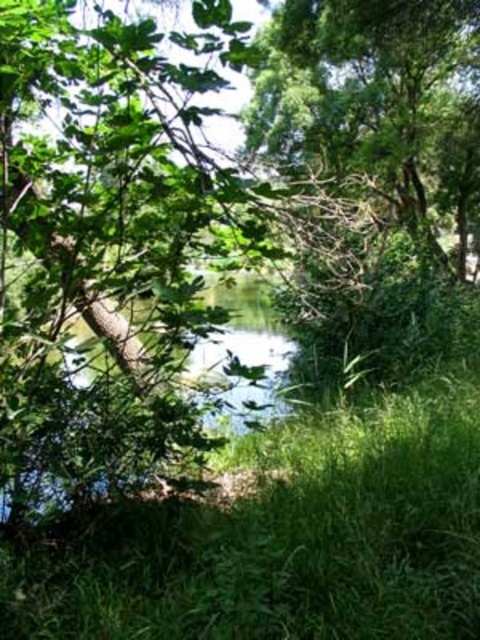
Does green leafy grass at center have a larger size compared to green leafy tree at upper center?

Incorrect, green leafy grass at center is not larger than green leafy tree at upper center.

Is green leafy grass at center smaller than green leafy tree at upper center?

Yes.

Find the location of a particular element. green leafy grass at center is located at coordinates (283, 538).